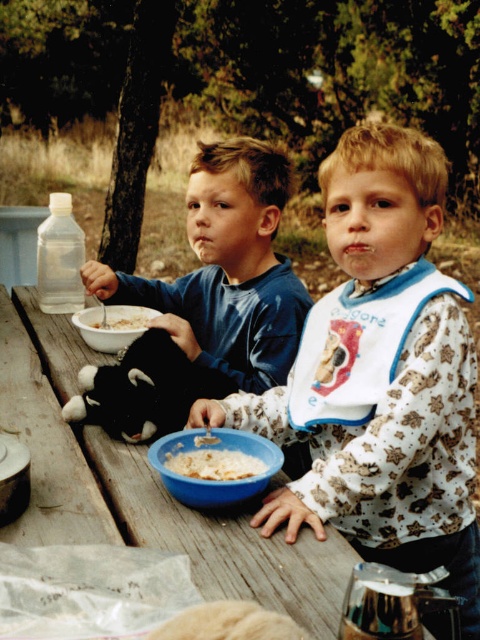
Question: Is blue cotton shirt at center bigger than white matte bowl at center?

Choices:
 (A) no
 (B) yes

Answer: (B)

Question: Where is blue cotton shirt at center located in relation to matte plastic bowl of cereal at center in the image?

Choices:
 (A) above
 (B) below

Answer: (A)

Question: Among these objects, which one is farthest from the camera?

Choices:
 (A) white fluffy rice at lower center
 (B) blue cotton shirt at center

Answer: (B)

Question: Does white cotton bib at center come in front of white fluffy rice at lower center?

Choices:
 (A) yes
 (B) no

Answer: (A)

Question: Which object is closer to the camera taking this photo?

Choices:
 (A) matte plastic bowl of cereal at center
 (B) blue cotton shirt at center

Answer: (A)

Question: Which is farther from the white creamy cereal at bowl center?

Choices:
 (A) blue cotton shirt at center
 (B) white fluffy rice at lower center
 (C) white matte bowl at center

Answer: (B)